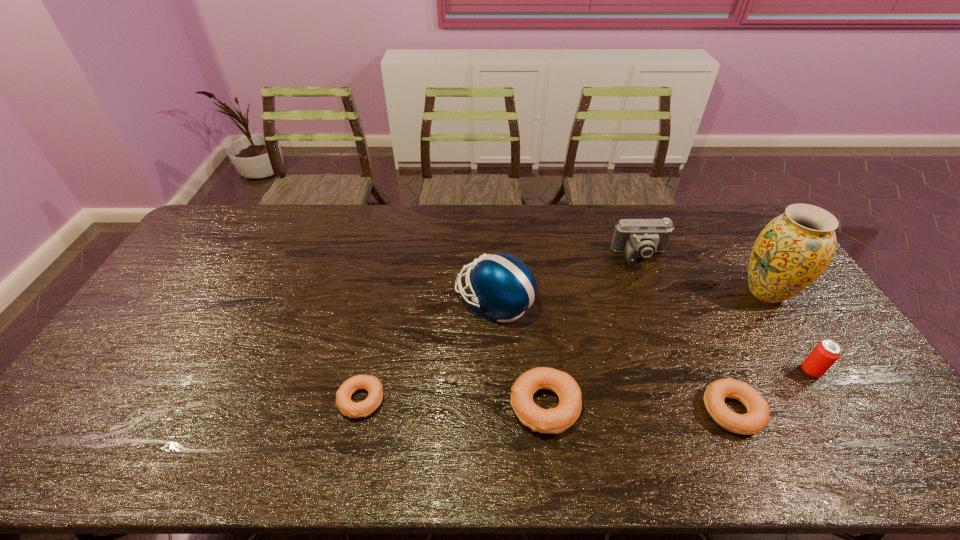
Identify the location of vase that is positioned at the right edge. The width and height of the screenshot is (960, 540). (795, 248).

This screenshot has width=960, height=540. I want to click on free space at the far edge of the desktop, so click(x=345, y=231).

Image resolution: width=960 pixels, height=540 pixels. In the image, there is a desktop. Identify the location of free space at the near edge. tap(180, 392).

Locate an element on the screen. Image resolution: width=960 pixels, height=540 pixels. vacant space at the left edge of the desktop is located at coordinates (104, 368).

This screenshot has width=960, height=540. In order to click on free location at the right edge of the desktop in this screenshot , I will do `click(822, 318)`.

I want to click on vacant space at the far right corner of the desktop, so click(745, 220).

Find the location of `free space between the tallest object and the second tallest bagel`. free space between the tallest object and the second tallest bagel is located at coordinates (749, 351).

Identify the location of unoccupied position between the camera and the leftmost object. This screenshot has height=540, width=960. pyautogui.click(x=501, y=329).

Identify the location of vacant space in between the camera and the second bagel from left to right. (593, 332).

I want to click on empty space between the football helmet and the shortest bagel, so click(x=427, y=352).